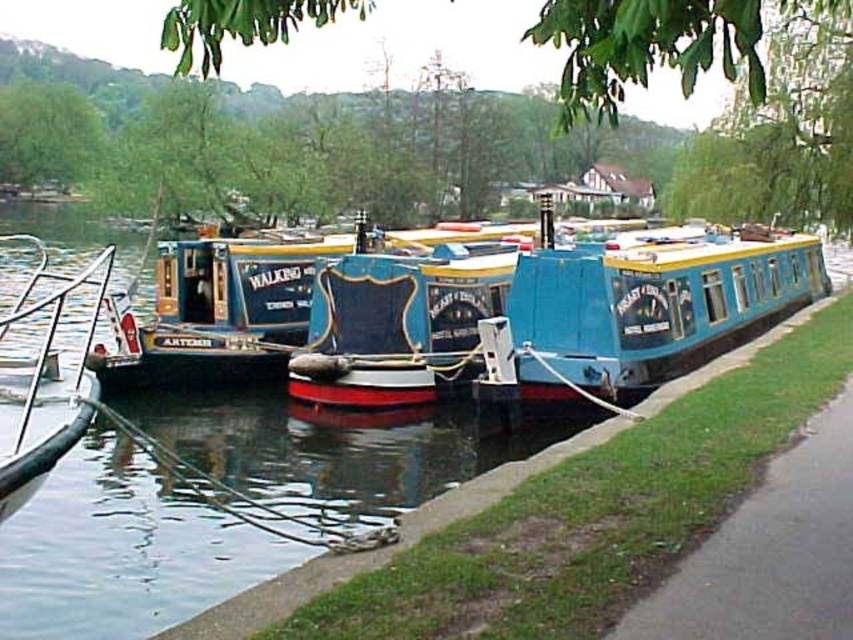
Question: Among these points, which one is nearest to the camera?

Choices:
 (A) (96, 257)
 (B) (659, 266)

Answer: (B)

Question: Can you confirm if blue matte houseboat at center is bigger than metallic silver boat at left?

Choices:
 (A) yes
 (B) no

Answer: (B)

Question: Can you confirm if blue matte houseboat at center is positioned to the right of metallic silver boat at left?

Choices:
 (A) yes
 (B) no

Answer: (A)

Question: Which point is farther from the camera taking this photo?

Choices:
 (A) (9, 406)
 (B) (598, 280)

Answer: (B)

Question: Is blue matte houseboat at center behind metallic silver boat at left?

Choices:
 (A) yes
 (B) no

Answer: (A)